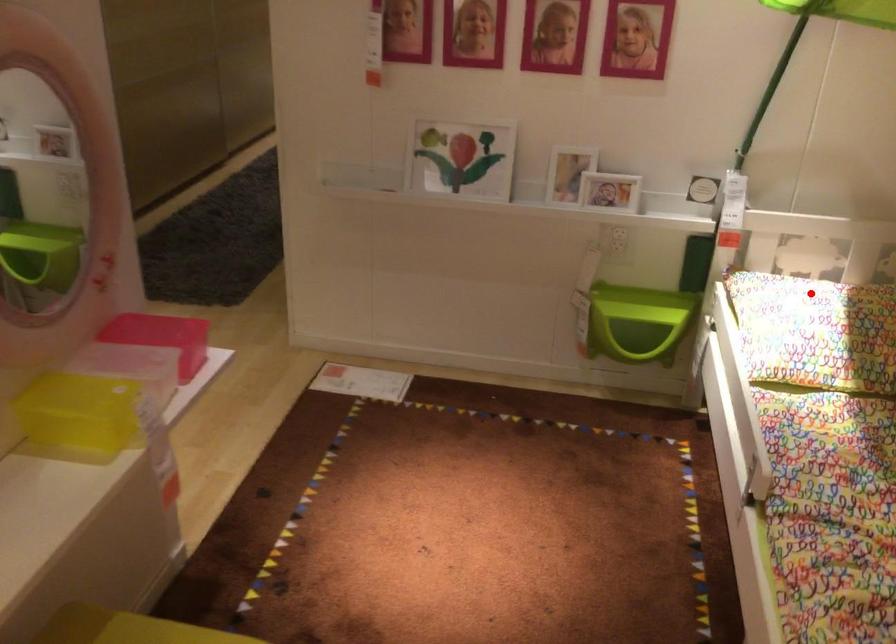
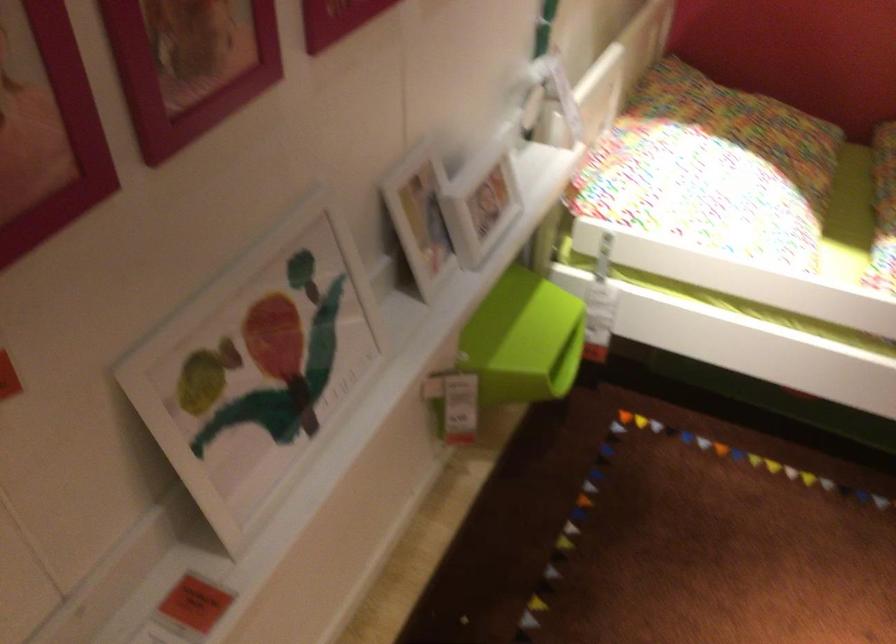
Find the pixel in the second image that matches the highlighted location in the first image.

(712, 169)